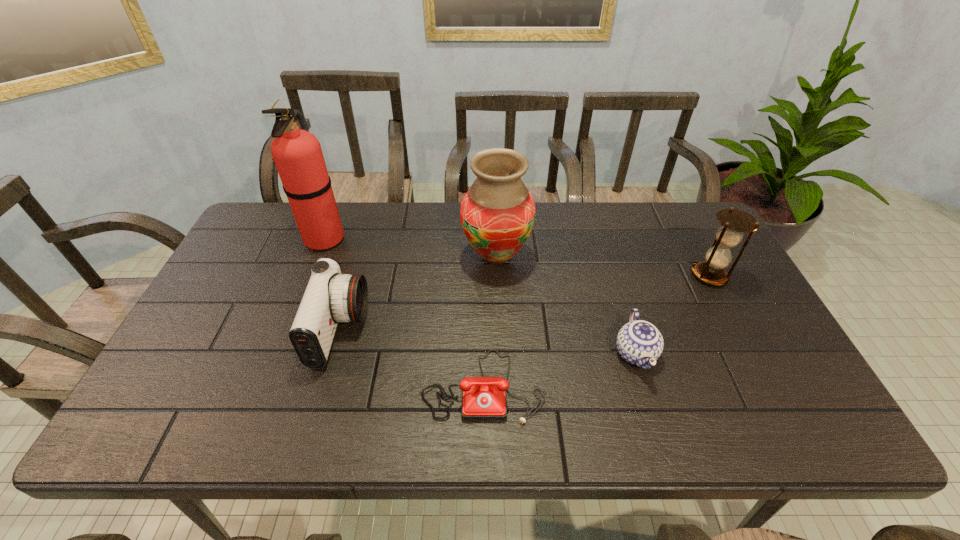
Locate an element on the screen. The width and height of the screenshot is (960, 540). vacant area situated at the nozzle of the tallest object is located at coordinates (423, 238).

The image size is (960, 540). In order to click on vacant space located on the front of the second tallest object in this screenshot , I will do `click(502, 407)`.

Locate an element on the screen. vacant space located on the front of the rightmost object is located at coordinates (774, 399).

Where is `vacant space situated on the surface of the camcorder`? Image resolution: width=960 pixels, height=540 pixels. vacant space situated on the surface of the camcorder is located at coordinates (494, 330).

Identify the location of fire extinguisher positioned at the far edge. This screenshot has height=540, width=960. (297, 154).

Identify the location of vase at the far edge. (497, 214).

The height and width of the screenshot is (540, 960). Identify the location of object situated at the near edge. (483, 398).

The width and height of the screenshot is (960, 540). Identify the location of object that is at the right edge. (735, 222).

Locate an element on the screen. The image size is (960, 540). free region at the far edge is located at coordinates (351, 247).

What are the coordinates of `vacant position at the near edge of the desktop` in the screenshot? It's located at (425, 426).